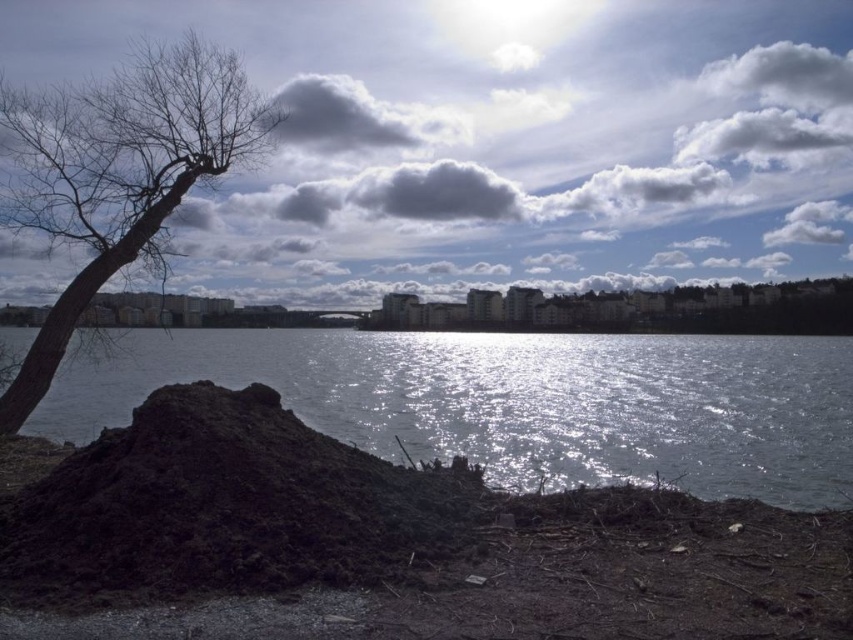
Question: Estimate the real-world distances between objects in this image. Which object is closer to the cloudy sky at upper center?

Choices:
 (A) dark soil mound at lower left
 (B) glistening water at center
 (C) bare wood tree at left

Answer: (B)

Question: Which point is closer to the camera?

Choices:
 (A) (224, 88)
 (B) (224, 544)
 (C) (573, 40)
 (D) (526, 483)

Answer: (B)

Question: Which point is farther to the camera?

Choices:
 (A) bare wood tree at left
 (B) glistening water at center
 (C) cloudy sky at upper center

Answer: (C)

Question: Is dark soil mound at lower left below bare wood tree at left?

Choices:
 (A) no
 (B) yes

Answer: (B)

Question: Does glistening water at center have a larger size compared to dark soil mound at lower left?

Choices:
 (A) yes
 (B) no

Answer: (A)

Question: Is cloudy sky at upper center to the right of glistening water at center from the viewer's perspective?

Choices:
 (A) yes
 (B) no

Answer: (A)